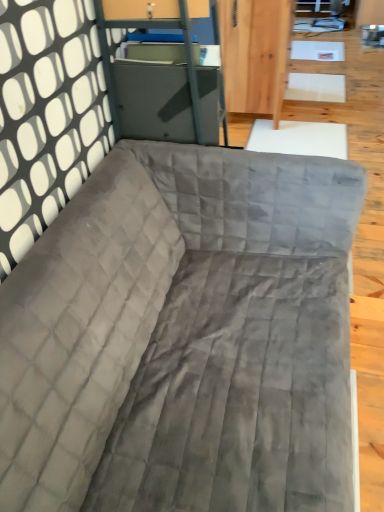
Question: Is matte gray metal file cabinet at upper center not inside velvet gray couch at center?

Choices:
 (A) yes
 (B) no

Answer: (A)

Question: Does matte gray metal file cabinet at upper center lie behind velvet gray couch at center?

Choices:
 (A) yes
 (B) no

Answer: (A)

Question: Are matte gray metal file cabinet at upper center and velvet gray couch at center far apart?

Choices:
 (A) yes
 (B) no

Answer: (B)

Question: Are matte gray metal file cabinet at upper center and velvet gray couch at center beside each other?

Choices:
 (A) no
 (B) yes

Answer: (A)

Question: Is velvet gray couch at center inside matte gray metal file cabinet at upper center?

Choices:
 (A) yes
 (B) no

Answer: (B)

Question: Does matte gray metal file cabinet at upper center have a greater width compared to velvet gray couch at center?

Choices:
 (A) no
 (B) yes

Answer: (A)

Question: From the image's perspective, is velvet gray couch at center on matte gray metal file cabinet at upper center?

Choices:
 (A) no
 (B) yes

Answer: (A)

Question: Does velvet gray couch at center have a lesser width compared to matte gray metal file cabinet at upper center?

Choices:
 (A) yes
 (B) no

Answer: (B)

Question: Is velvet gray couch at center behind matte gray metal file cabinet at upper center?

Choices:
 (A) no
 (B) yes

Answer: (A)

Question: Could you tell me if velvet gray couch at center is turned towards matte gray metal file cabinet at upper center?

Choices:
 (A) no
 (B) yes

Answer: (A)

Question: Is velvet gray couch at center smaller than matte gray metal file cabinet at upper center?

Choices:
 (A) yes
 (B) no

Answer: (B)

Question: From the image's perspective, is velvet gray couch at center below matte gray metal file cabinet at upper center?

Choices:
 (A) yes
 (B) no

Answer: (A)

Question: In the image, is matte gray metal file cabinet at upper center on the left side or the right side of velvet gray couch at center?

Choices:
 (A) right
 (B) left

Answer: (B)